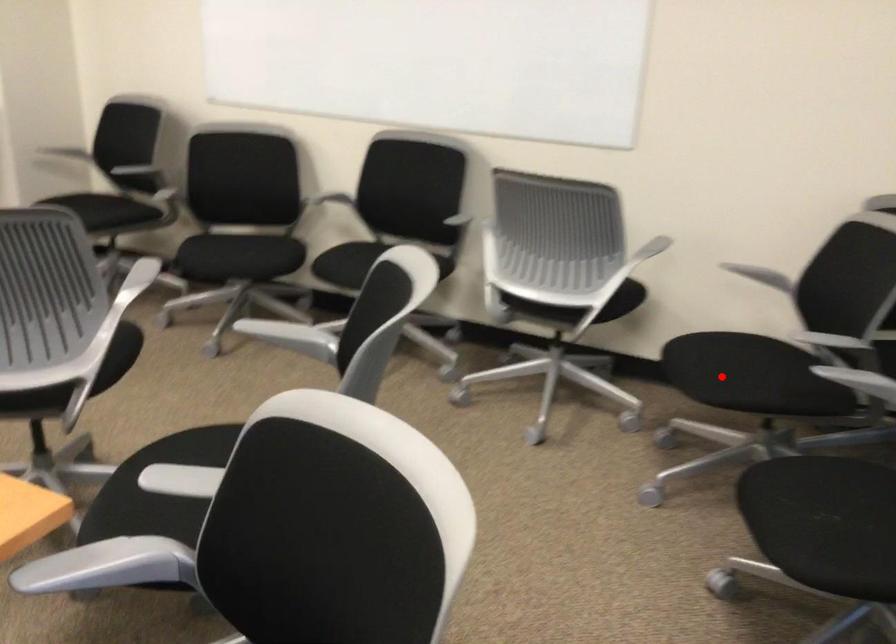
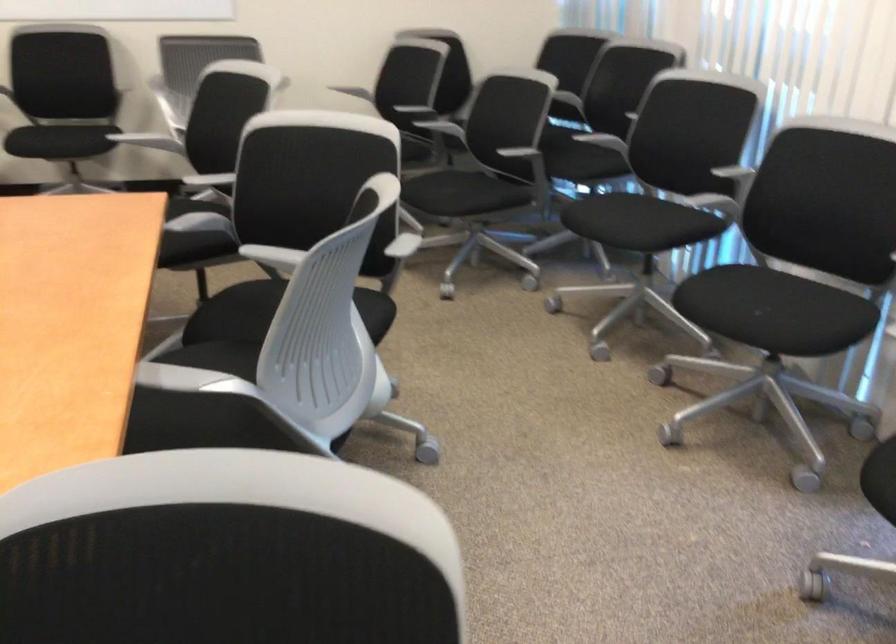
Question: I am providing you with two images of the same scene from different viewpoints. A red point is marked on the first image. Can you still see the location of the red point in image 2?

Choices:
 (A) Yes
 (B) No

Answer: (B)